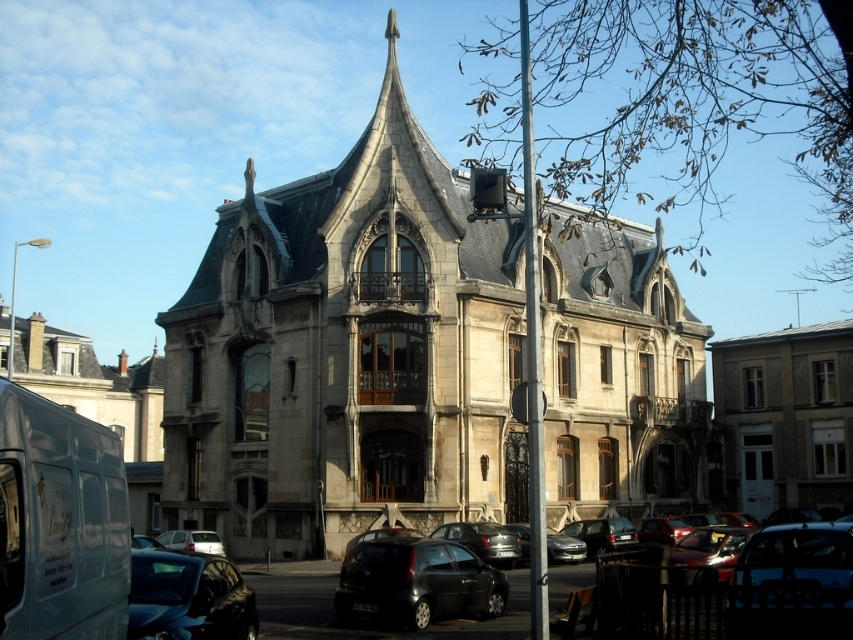
You are a delivery driver who needs to park your 2.5 meters wide truck between the shiny black car at center and the white matte car at lower left. Can you fit your truck there?

The shiny black car at center is wider than the white matte car at lower left. However, the exact width difference isn not provided, so it is uncertain if the space between them can accommodate a 2.5 meters wide truck. Please check the available space carefully before attempting to park.

Based on the scene description, which object is larger in size between the stone church at center and the shiny blue car at lower left?

The stone church at center is bigger than the shiny blue car at lower left according to the description.